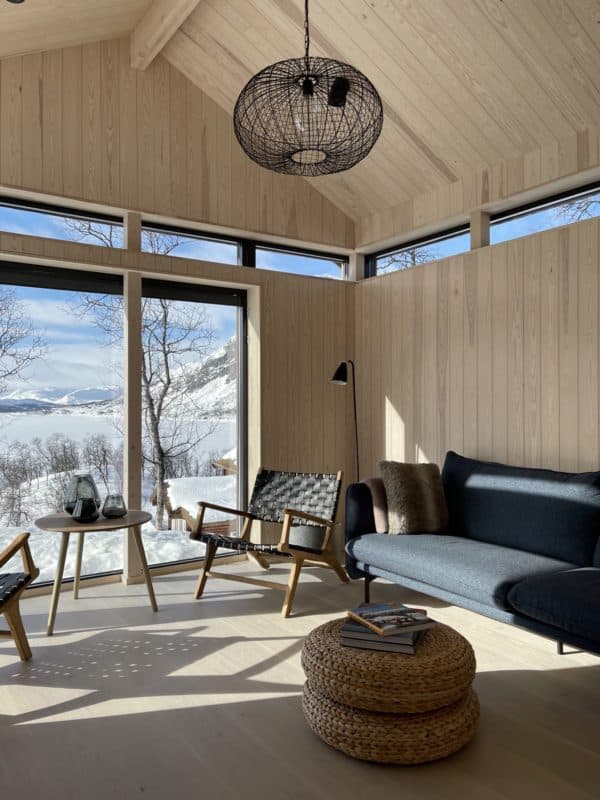
Locate an element on the screen. The image size is (600, 800). table is located at coordinates (137, 510).